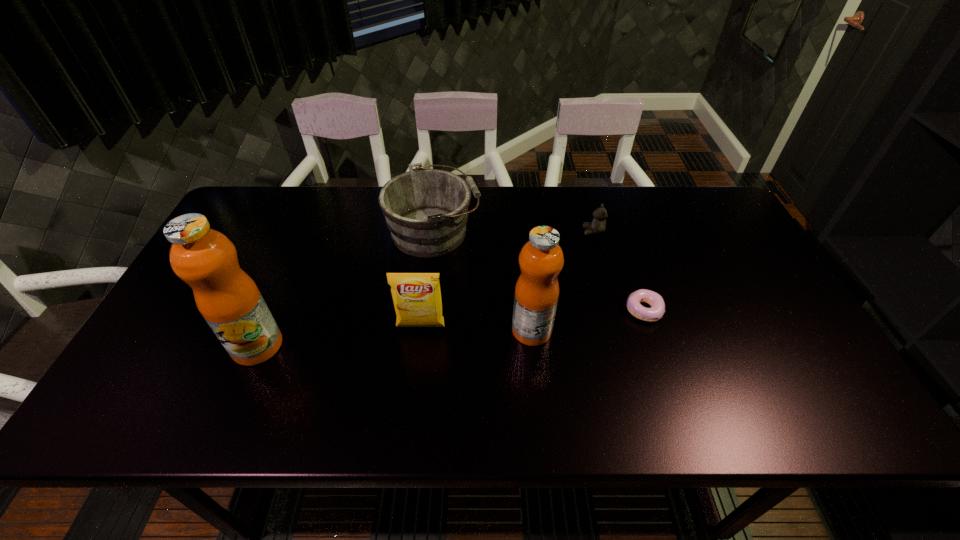
The image size is (960, 540). I want to click on vacant space at the near edge, so click(x=312, y=360).

The height and width of the screenshot is (540, 960). In the image, there is a desktop. Find the location of `vacant space at the left edge`. vacant space at the left edge is located at coordinates (163, 330).

You are a GUI agent. You are given a task and a screenshot of the screen. Output one action in this format:
    pyautogui.click(x=<x>, y=<y>)
    Task: Click on the vacant space at the right edge
    The height and width of the screenshot is (540, 960).
    Given the screenshot: What is the action you would take?
    pyautogui.click(x=745, y=282)

In the image, there is a desktop. Where is `free space at the near left corner`? free space at the near left corner is located at coordinates (186, 360).

This screenshot has height=540, width=960. In the image, there is a desktop. Identify the location of vacant space at the far right corner. (719, 213).

The image size is (960, 540). I want to click on vacant space that is in between the shortest object and the taller fruit juice, so click(x=450, y=328).

You are a GUI agent. You are given a task and a screenshot of the screen. Output one action in this format:
    pyautogui.click(x=<x>, y=<y>)
    Task: Click on the free space between the teddy bear and the fourth tallest object
    
    Given the screenshot: What is the action you would take?
    pyautogui.click(x=514, y=232)

You are a GUI agent. You are given a task and a screenshot of the screen. Output one action in this format:
    pyautogui.click(x=<x>, y=<y>)
    Task: Click on the free space between the teddy bear and the right fruit juice
    
    Given the screenshot: What is the action you would take?
    pyautogui.click(x=563, y=281)

Find the location of a particular element. empty space between the crisp (potato chip) and the teddy bear is located at coordinates (507, 279).

You are a GUI agent. You are given a task and a screenshot of the screen. Output one action in this format:
    pyautogui.click(x=<x>, y=<y>)
    Task: Click on the blank region between the teddy bear and the right fruit juice
    
    Given the screenshot: What is the action you would take?
    pyautogui.click(x=563, y=281)